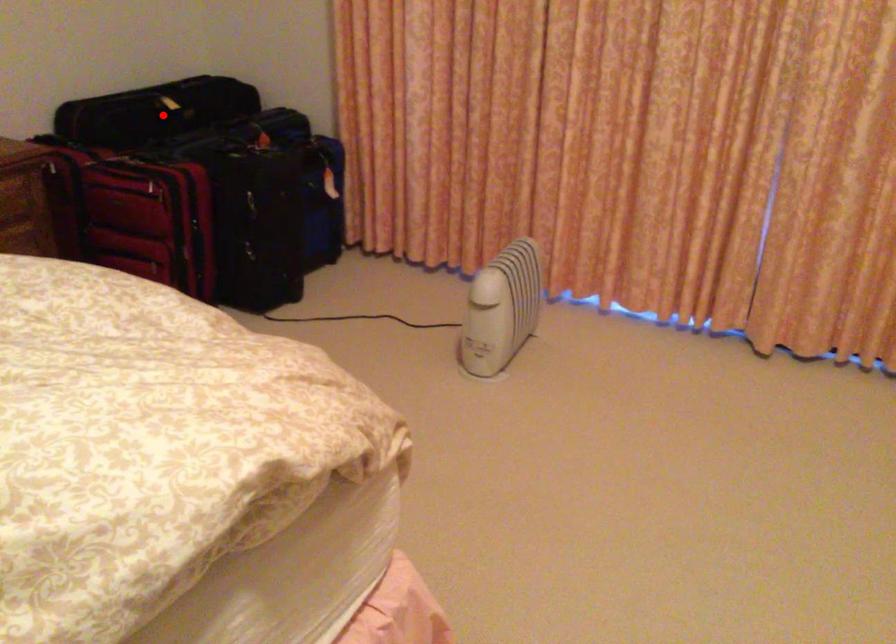
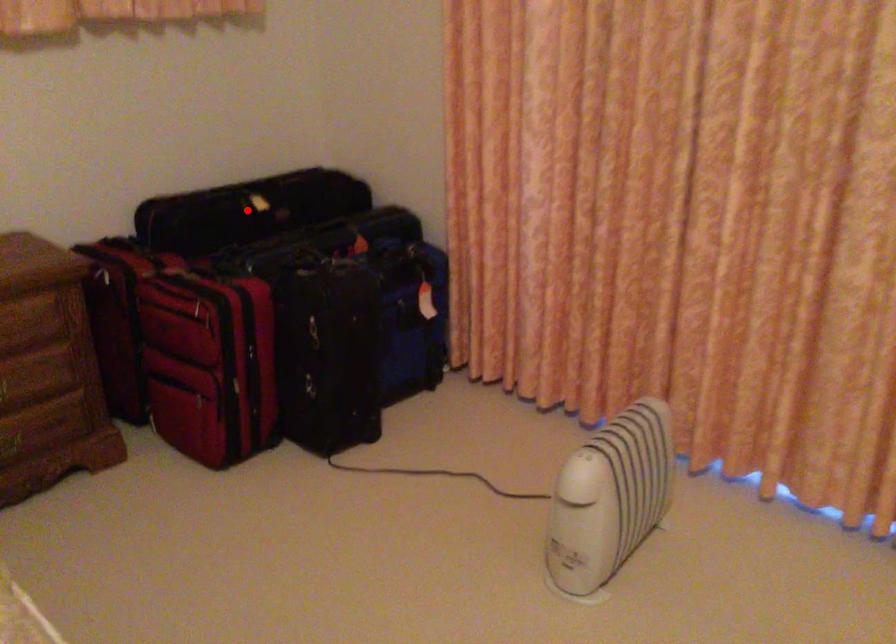
I am providing you with two images of the same scene from different viewpoints. A red point is marked on the first image and another point is marked on the second image. Is the red point in image1 aligned with the point shown in image2?

Yes